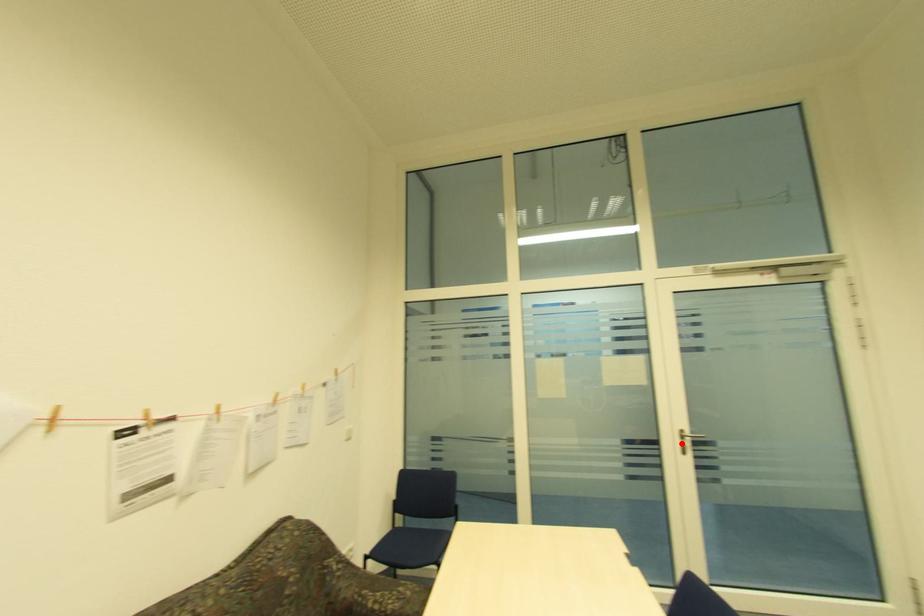
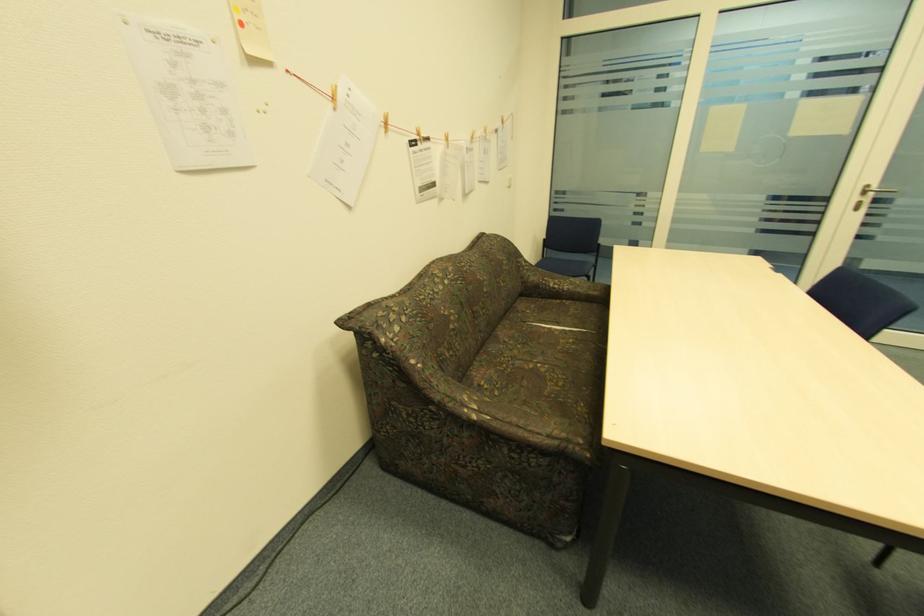
The point at the highlighted location is marked in the first image. Where is the corresponding point in the second image?

(859, 199)